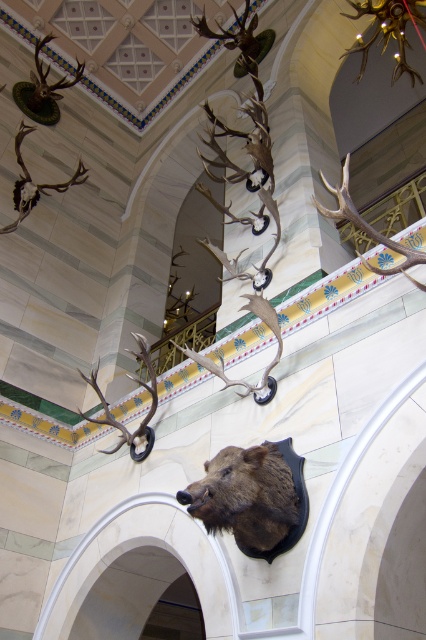
Question: Which object is positioned closest to the white marble archway at center?

Choices:
 (A) brown furry head at center
 (B) shiny brown antlers at upper left

Answer: (A)

Question: Which point is closer to the camera?

Choices:
 (A) (155, 500)
 (B) (112, 426)
 (C) (54, 35)
 (D) (25, 208)

Answer: (A)

Question: Does brown furry head at center appear under white marble archway at center?

Choices:
 (A) yes
 (B) no

Answer: (B)

Question: Is shiny brown antlers at left to the right of shiny silver antlers at upper left from the viewer's perspective?

Choices:
 (A) no
 (B) yes

Answer: (B)

Question: Which object is farther from the camera taking this photo?

Choices:
 (A) brown furry head at center
 (B) shiny brown antlers at upper left

Answer: (B)

Question: Can you confirm if brown furry head at center is wider than white marble archway at center?

Choices:
 (A) no
 (B) yes

Answer: (A)